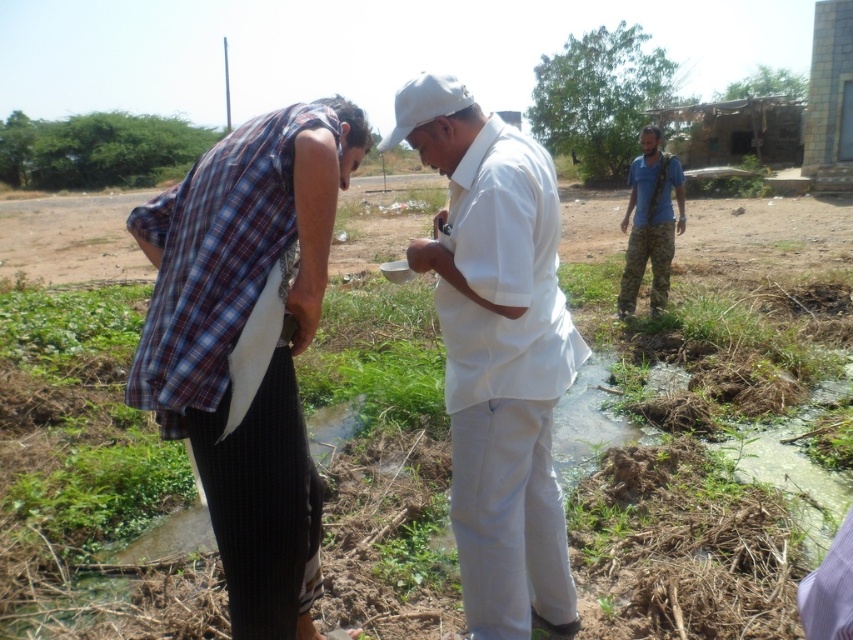
Question: Does plaid fabric shirt at left appear under white matte shirt at center?

Choices:
 (A) yes
 (B) no

Answer: (A)

Question: Which object is positioned closest to the white matte shirt at center?

Choices:
 (A) plaid fabric shirt at left
 (B) camouflage pants at right

Answer: (A)

Question: Which of the following is the closest to the observer?

Choices:
 (A) plaid fabric shirt at left
 (B) camouflage pants at right

Answer: (A)

Question: Considering the relative positions of plaid fabric shirt at left and white matte shirt at center in the image provided, where is plaid fabric shirt at left located with respect to white matte shirt at center?

Choices:
 (A) below
 (B) above

Answer: (A)

Question: Can you confirm if white matte shirt at center is wider than camouflage pants at right?

Choices:
 (A) yes
 (B) no

Answer: (A)

Question: Which object is farther from the camera taking this photo?

Choices:
 (A) camouflage pants at right
 (B) plaid fabric shirt at left
 (C) white matte shirt at center

Answer: (A)